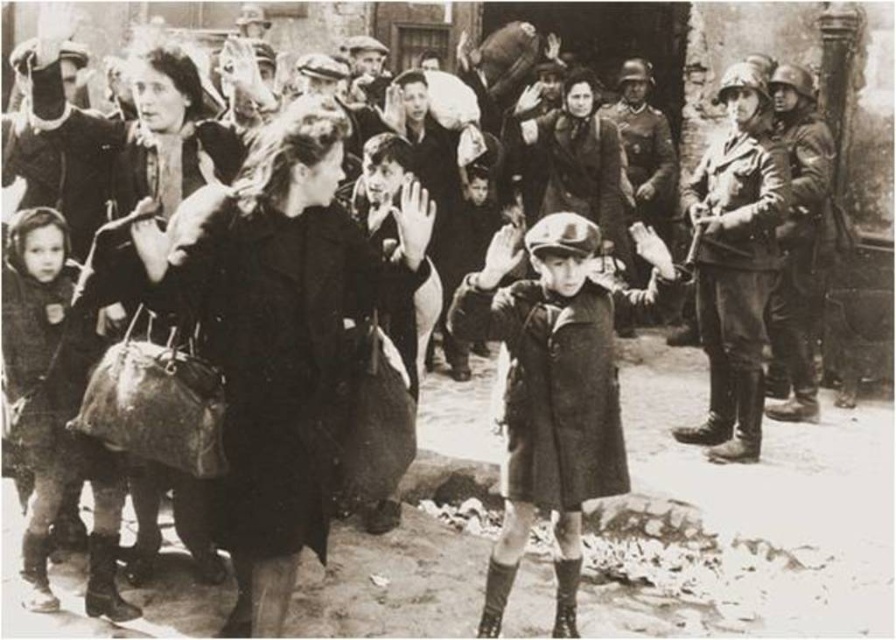
Is point (278, 184) positioned in front of point (50, 336)?

Yes, it is in front of point (50, 336).

Can you confirm if dark wool coat at center is positioned below dark gray fabric coat at left?

No.

Who is more forward, (317, 278) or (71, 336)?

Point (317, 278) is more forward.

Locate an element on the screen. The height and width of the screenshot is (640, 896). dark wool coat at center is located at coordinates (280, 332).

Does dark woolen coat at center lie in front of dark gray fabric coat at left?

Yes, it is in front of dark gray fabric coat at left.

Can you confirm if dark woolen coat at center is bigger than dark gray fabric coat at left?

Yes, dark woolen coat at center is bigger than dark gray fabric coat at left.

Is point (470, 324) farther from viewer compared to point (22, 253)?

No, it is not.

Locate an element on the screen. The width and height of the screenshot is (896, 640). dark woolen coat at center is located at coordinates (553, 387).

Does dark wool coat at center appear on the right side of dark woolen coat at center?

No, dark wool coat at center is not to the right of dark woolen coat at center.

Who is lower down, dark wool coat at center or dark woolen coat at center?

Positioned lower is dark woolen coat at center.

Find the location of a particular element. dark wool coat at center is located at coordinates (280, 332).